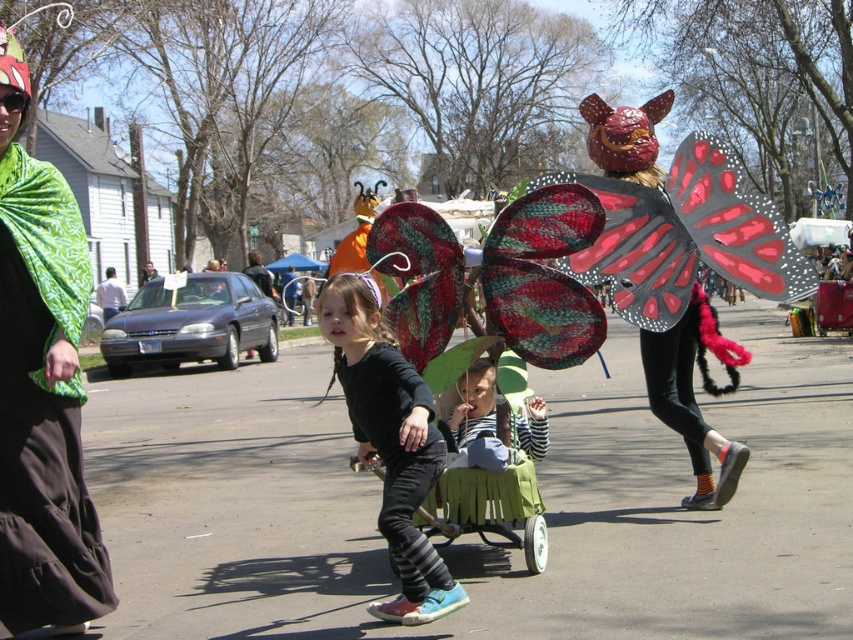
You are standing at the starting point and want to reach the destination. The path goes through two checkpoints marked by point 1 at point (0, 282) and point 2 at point (532, 420). According to the scene, which checkpoint should you reach first?

Point 1 at point (0, 282) is in front of point 2 at point (532, 420), so you should reach point 1 first.

You are a photographer trying to capture the two children in the scene. The black matte leggings at center and the striped fabric at center are both in your viewfinder. Which object should you focus on if you want to photograph the taller one?

The black matte leggings at center is taller than striped fabric at center, so you should focus on the black matte leggings at center to photograph the taller one.